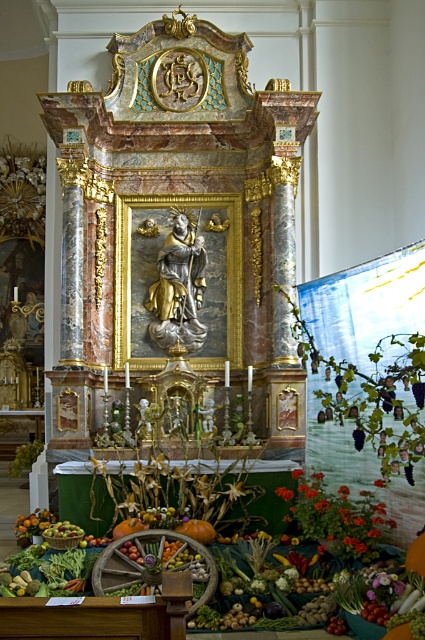
You are an altar attendant who needs to place a new candle between the vibrant orange petals at center and the smooth orange fruit at lower left. Based on their positions, which object should the candle be closer to?

The candle should be placed closer to the smooth orange fruit at lower left because the vibrant orange petals at center is positioned on the right side of it.

From the picture: You are standing in front of the altar and want to place a small offering directly in front of the gold plated statue at center. Based on the altar layout, where should you place the offering to ensure it is positioned correctly?

To place the offering directly in front of the gold plated statue at center, position it at the coordinates specified by the statue, which is at point (178, 285). This ensures the offering is correctly placed in front of the statue.